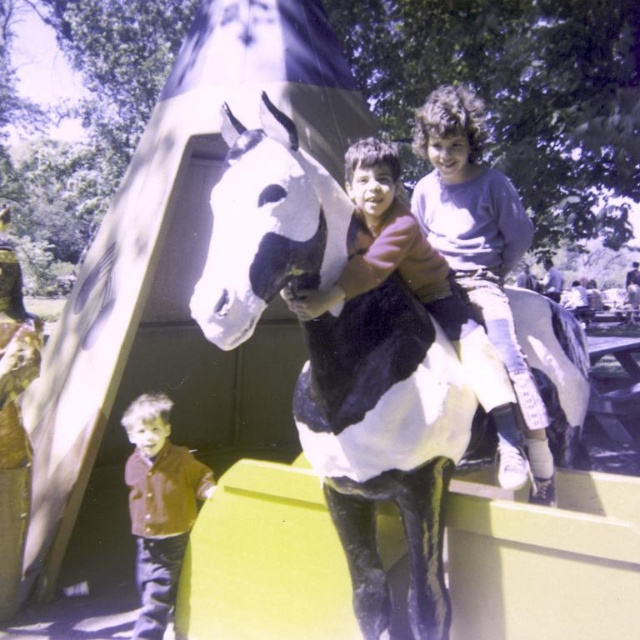
You are a photographer trying to capture both the purple cotton shirt at upper right and the brown velvet jacket at lower left in a single frame. Which clothing item appears larger in the photo?

The purple cotton shirt at upper right appears larger in the photo because it is bigger than the brown velvet jacket at lower left.

You are a photographer trying to capture a photo of both children in the scene. The purple cotton shirt at upper right and the brown velvet jacket at lower left are in different positions. Which child should you focus on first to ensure both are in frame?

The purple cotton shirt at upper right is above the brown velvet jacket at lower left, so you should focus on the child in the brown velvet jacket at lower left first to ensure both are in frame.